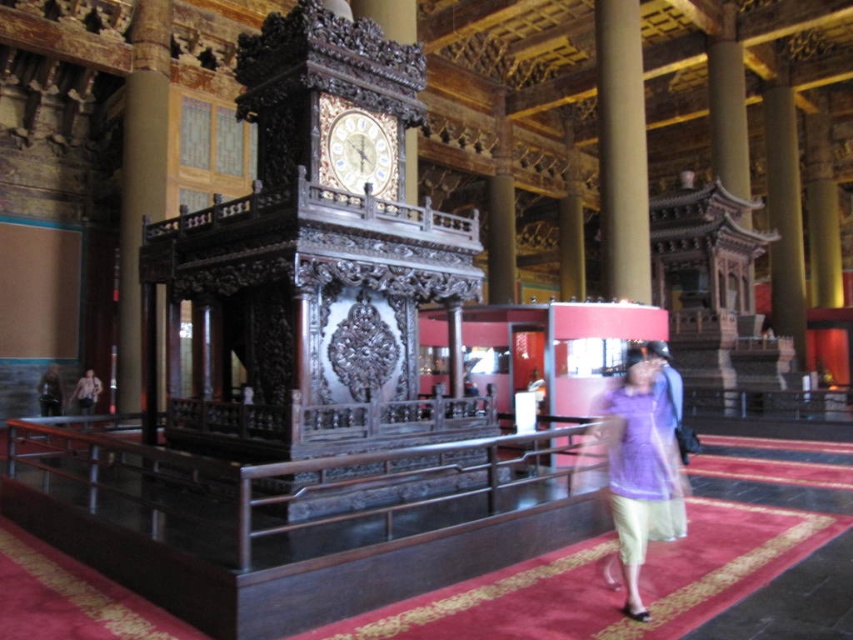
Question: Observing the image, what is the correct spatial positioning of brown polished wood pillar at left in reference to light purple fabric dress at lower center?

Choices:
 (A) left
 (B) right

Answer: (B)

Question: Is brown polished wood pillar at left further to the viewer compared to light purple fabric dress at lower center?

Choices:
 (A) yes
 (B) no

Answer: (B)

Question: Among these objects, which one is farthest from the camera?

Choices:
 (A) carved wood structure at upper right
 (B) purple fabric dress at center
 (C) brown polished wood pillar at left

Answer: (A)

Question: Does purple fabric dress at center appear under smooth beige column at center?

Choices:
 (A) no
 (B) yes

Answer: (B)

Question: Among these objects, which one is nearest to the camera?

Choices:
 (A) carved wood structure at upper right
 (B) brown polished wood pillar at left
 (C) smooth beige column at center
 (D) smooth polished wood pillar at right

Answer: (B)

Question: Estimate the real-world distances between objects in this image. Which object is closer to the brown polished wood pillar at left?

Choices:
 (A) light purple fabric dress at lower center
 (B) gold metallic clock at center

Answer: (A)